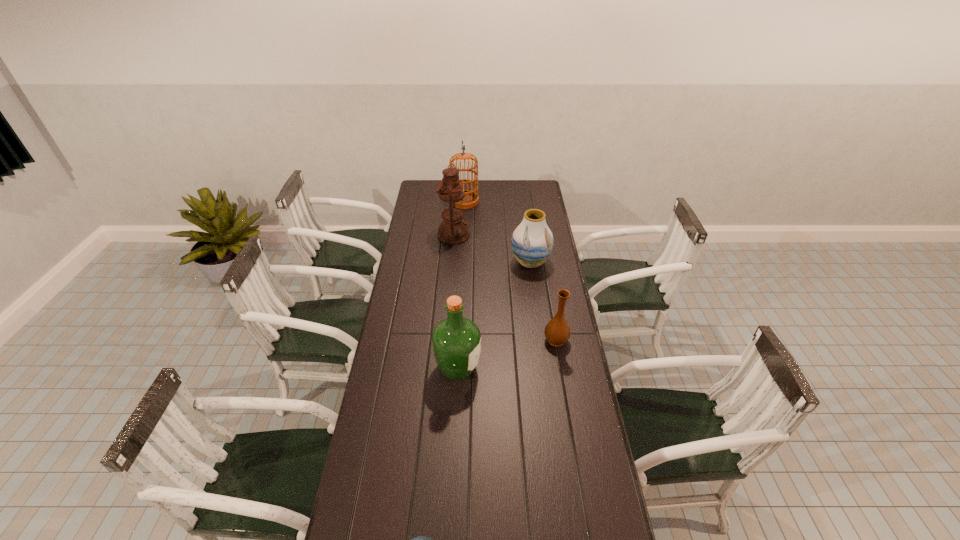
The width and height of the screenshot is (960, 540). I want to click on the closest vase relative to the leftmost vase, so click(557, 331).

Find the location of a particular element. free region that satisfies the following two spatial constraints: 1. on the front side of the fourth nearest object; 2. on the left side of the second farthest vase is located at coordinates (541, 340).

The height and width of the screenshot is (540, 960). What are the coordinates of `free space that satisfies the following two spatial constraints: 1. on the front side of the fifth nearest object; 2. on the right side of the farthest vase` in the screenshot? It's located at (451, 262).